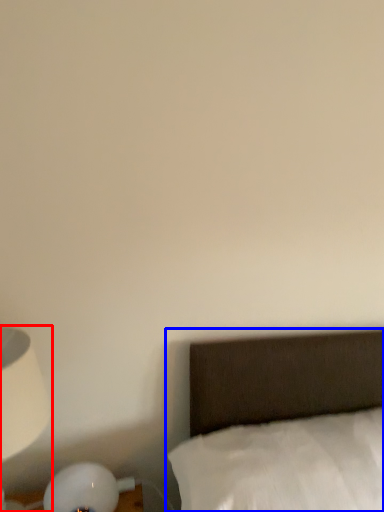
Question: Among these objects, which one is farthest to the camera, lamp (highlighted by a red box) or bed (highlighted by a blue box)?

Choices:
 (A) lamp
 (B) bed

Answer: (A)